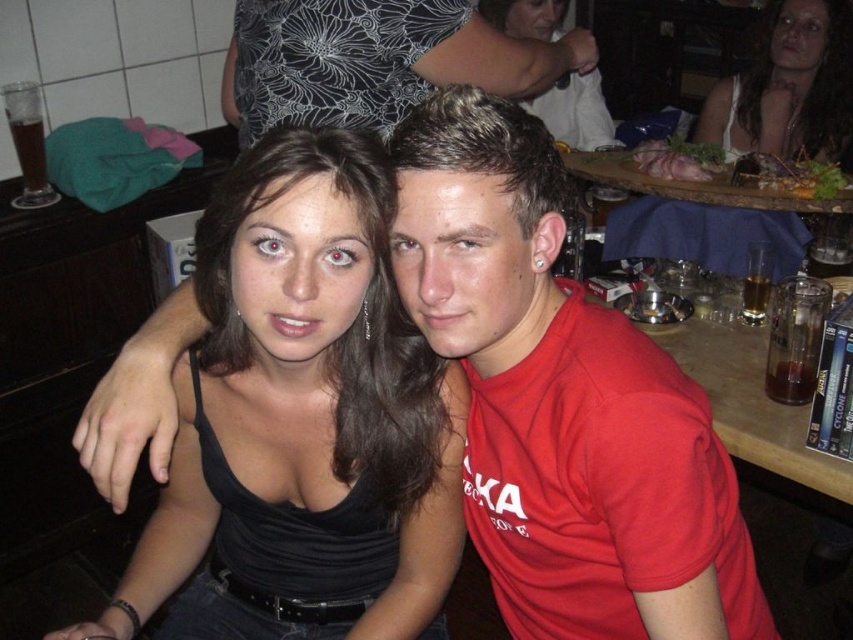
Between point (425, 563) and point (767, 93), which one is positioned behind?

The point (767, 93) is behind.

Is black matte tank top at center to the left of white matte dress at upper right from the viewer's perspective?

Correct, you'll find black matte tank top at center to the left of white matte dress at upper right.

Which is in front, point (343, 392) or point (802, 132)?

Point (343, 392)

This screenshot has height=640, width=853. What are the coordinates of `black matte tank top at center` in the screenshot? It's located at (302, 422).